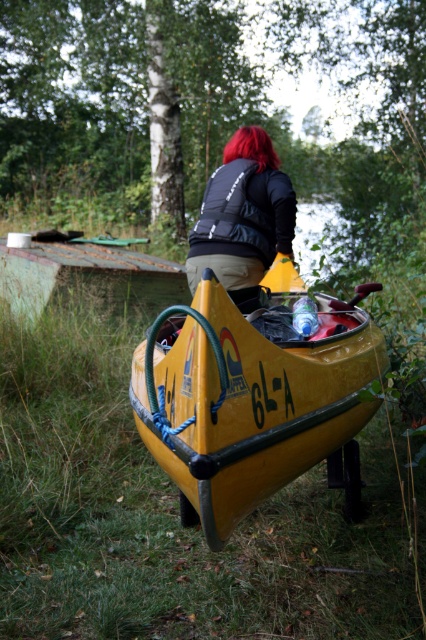
You are planning to store the yellow matte boat at center and the black matte vest at center in a storage room. The storage room has a shelf that can only hold items up to 1 meter in width. Based on their widths, can both items fit on the shelf together?

The yellow matte boat at center might be wider than black matte vest at center, so it is uncertain if both can fit on the shelf together without exceeding the 1 meter width limit.

You are a park ranger checking equipment placement. The yellow matte boat at center and the black matte vest at center must be arranged so that the vest is above the boat. Is the current arrangement correct?

The yellow matte boat at center is located below the black matte vest at center, so the current arrangement meets the requirement that the vest is above the boat.